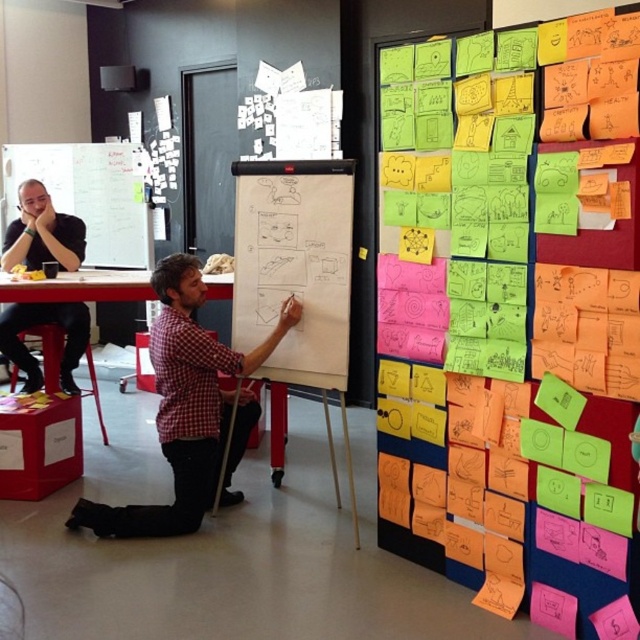
Which of these two, white paperboard at center or whiteboard at upper left, stands shorter?

whiteboard at upper left is shorter.

Which is in front, point (289, 172) or point (51, 180)?

Point (289, 172) is more forward.

Where is `white paperboard at center`? white paperboard at center is located at coordinates (294, 266).

The height and width of the screenshot is (640, 640). I want to click on white paperboard at center, so 294,266.

The height and width of the screenshot is (640, 640). What do you see at coordinates (182, 406) in the screenshot?
I see `red checkered shirt at center` at bounding box center [182, 406].

Is red checkered shirt at center positioned behind black matte shirt at upper left?

That is False.

Between point (177, 296) and point (77, 221), which one is positioned in front?

Point (177, 296)

The width and height of the screenshot is (640, 640). In order to click on red checkered shirt at center in this screenshot , I will do `click(182, 406)`.

Does whiteboard at upper left appear under black matte shirt at upper left?

Incorrect, whiteboard at upper left is not positioned below black matte shirt at upper left.

Is point (122, 266) farther from viewer compared to point (12, 253)?

Yes.

Does point (58, 163) come behind point (12, 308)?

That is True.

This screenshot has width=640, height=640. I want to click on whiteboard at upper left, so click(90, 195).